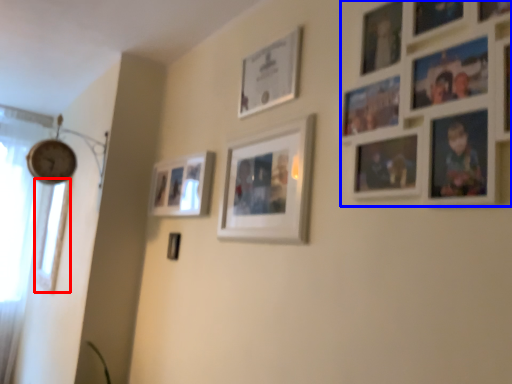
Question: Which object appears farthest to the camera in this image, window (highlighted by a red box) or picture frame (highlighted by a blue box)?

Choices:
 (A) window
 (B) picture frame

Answer: (A)